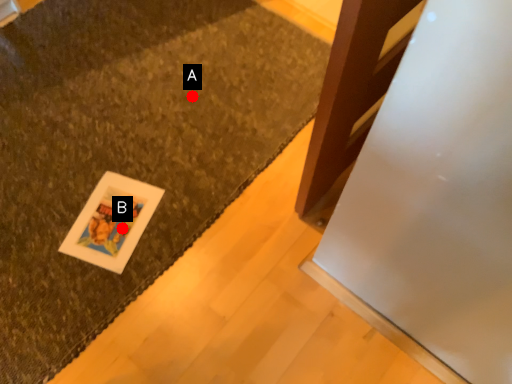
Question: Two points are circled on the image, labeled by A and B beside each circle. Among these points, which one is farthest from the camera?

Choices:
 (A) A is further
 (B) B is further

Answer: (A)